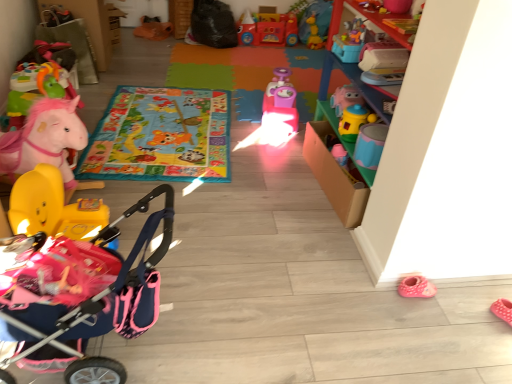
Question: In which direction should I rotate to look at pink plastic toy car at center, positioned as the fourth toy in back-to-front order?

Choices:
 (A) right
 (B) left

Answer: (A)

Question: Is matte pink plush horse at left, which is counted as the 8th toy, starting from the back, thinner than vibrant fabric playmat at center, the second mat positioned from the back?

Choices:
 (A) yes
 (B) no

Answer: (A)

Question: Does matte pink plush horse at left, placed as the 2th toy when sorted from front to back, come behind vibrant fabric playmat at center, the second mat positioned from the back?

Choices:
 (A) no
 (B) yes

Answer: (A)

Question: Is matte pink plush horse at left, which is counted as the 8th toy, starting from the back, bigger than vibrant fabric playmat at center, arranged as the 1th mat when viewed from the front?

Choices:
 (A) no
 (B) yes

Answer: (B)

Question: From a real-world perspective, does matte pink plush horse at left, placed as the 2th toy when sorted from front to back, stand above vibrant fabric playmat at center, arranged as the 1th mat when viewed from the front?

Choices:
 (A) yes
 (B) no

Answer: (A)

Question: Is vibrant fabric playmat at center, arranged as the 1th mat when viewed from the front, completely or partially inside matte pink plush horse at left, which is counted as the 8th toy, starting from the back?

Choices:
 (A) yes
 (B) no

Answer: (B)

Question: Is the position of matte pink plush horse at left, which is counted as the 8th toy, starting from the back, less distant than that of vibrant fabric playmat at center, arranged as the 1th mat when viewed from the front?

Choices:
 (A) yes
 (B) no

Answer: (A)

Question: Is rubber duck at upper center, arranged as the 9th toy when viewed from the front, behind rubberized plastic toy car at upper center, arranged as the 8th toy when viewed from the front?

Choices:
 (A) yes
 (B) no

Answer: (A)

Question: Is rubber duck at upper center, arranged as the 9th toy when viewed from the front, taller than rubberized plastic toy car at upper center, arranged as the 8th toy when viewed from the front?

Choices:
 (A) no
 (B) yes

Answer: (A)

Question: From the image's perspective, is rubber duck at upper center, acting as the first toy starting from the back, beneath rubberized plastic toy car at upper center, arranged as the 8th toy when viewed from the front?

Choices:
 (A) yes
 (B) no

Answer: (A)

Question: Can you confirm if rubber duck at upper center, arranged as the 9th toy when viewed from the front, is smaller than rubberized plastic toy car at upper center, the second toy viewed from the back?

Choices:
 (A) no
 (B) yes

Answer: (B)

Question: Is rubberized plastic toy car at upper center, the second toy viewed from the back, surrounded by rubber duck at upper center, arranged as the 9th toy when viewed from the front?

Choices:
 (A) no
 (B) yes

Answer: (A)

Question: From the image's perspective, would you say rubber duck at upper center, arranged as the 9th toy when viewed from the front, is positioned over rubberized plastic toy car at upper center, the second toy viewed from the back?

Choices:
 (A) no
 (B) yes

Answer: (A)

Question: Is vibrant fabric playmat at center, the second mat positioned from the back, bigger than pink plush horse at left, which appears as the 5th toy when viewed from the back?

Choices:
 (A) yes
 (B) no

Answer: (B)